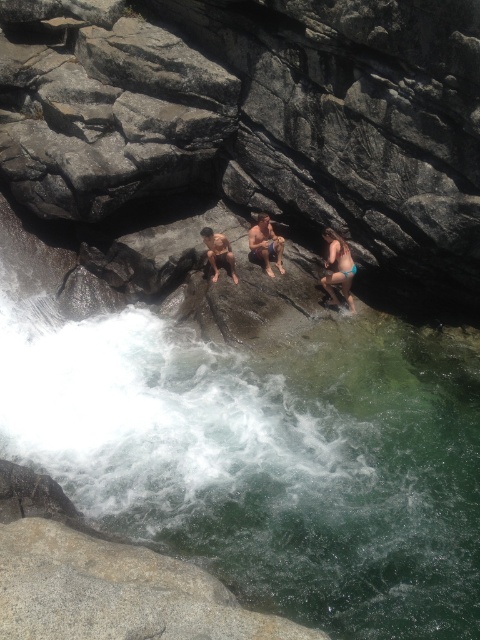
Question: Is teal bikini bottom at lower right bigger than smooth tan skin at center?

Choices:
 (A) no
 (B) yes

Answer: (B)

Question: Is clear water at center above teal bikini bottom at lower right?

Choices:
 (A) yes
 (B) no

Answer: (B)

Question: Where is teal bikini bottom at lower right located in relation to tan skin human at center in the image?

Choices:
 (A) below
 (B) above

Answer: (A)

Question: Which of the following is the closest to the observer?

Choices:
 (A) teal bikini bottom at lower right
 (B) clear water at center

Answer: (B)

Question: Which object is closer to the camera taking this photo?

Choices:
 (A) teal bikini bottom at lower right
 (B) smooth tan skin at center
 (C) clear water at center

Answer: (C)

Question: Estimate the real-world distances between objects in this image. Which object is closer to the tan skin human at center?

Choices:
 (A) clear water at center
 (B) teal bikini bottom at lower right
 (C) smooth tan skin at center

Answer: (C)